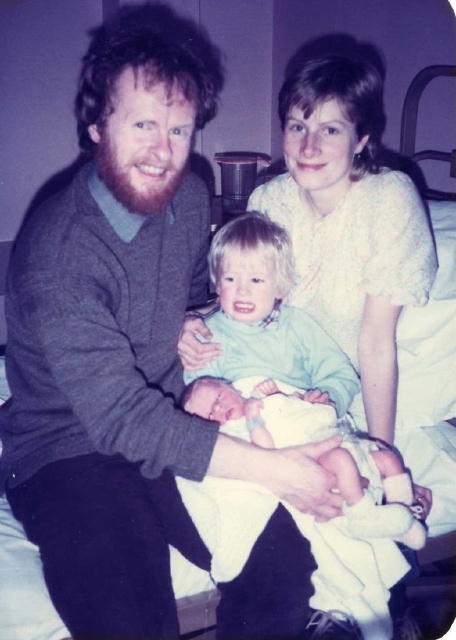
Describe the element at coordinates (286, 445) in the screenshot. I see `light green fabric baby at center` at that location.

This screenshot has width=456, height=640. Find the location of `light green fabric baby at center`. light green fabric baby at center is located at coordinates (286, 445).

Between white dotted blouse at upper center and white clothed baby at center, which one has more height?

With more height is white dotted blouse at upper center.

Is white dotted blouse at upper center wider than white clothed baby at center?

Incorrect, white dotted blouse at upper center's width does not surpass white clothed baby at center's.

Which is in front, point (435, 252) or point (269, 384)?

Positioned in front is point (269, 384).

In order to click on white dotted blouse at upper center in this screenshot , I will do `click(350, 221)`.

Consider the image. Is light green fabric baby at center to the right of white dotted blouse at upper center from the viewer's perspective?

In fact, light green fabric baby at center is to the left of white dotted blouse at upper center.

Does point (274, 547) come in front of point (267, 204)?

Yes, point (274, 547) is closer to viewer.

Between point (285, 408) and point (362, 214), which one is positioned behind?

The point (362, 214) is behind.

Image resolution: width=456 pixels, height=640 pixels. In order to click on light green fabric baby at center in this screenshot , I will do `click(286, 445)`.